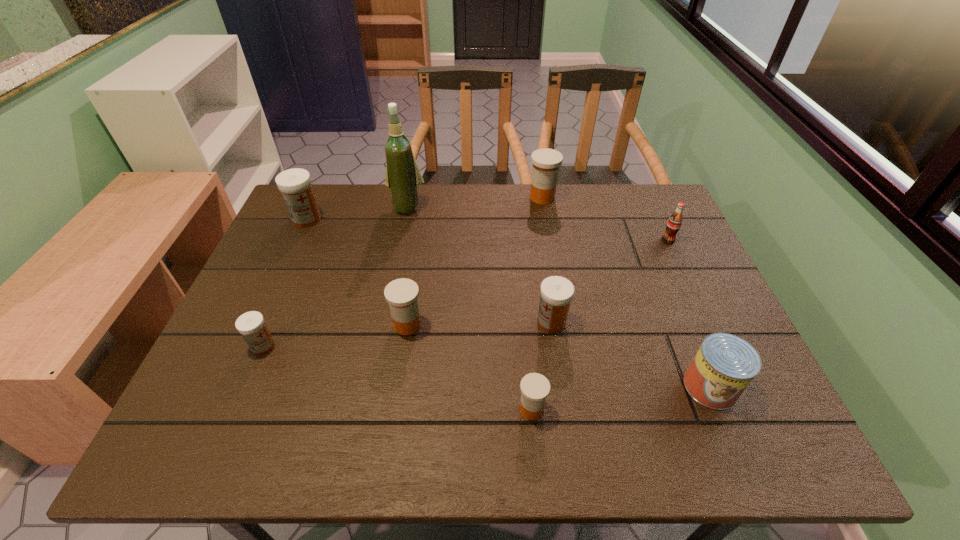
Find the location of a particular element. The image size is (960, 540). free location located 0.100m on the left of the can is located at coordinates (637, 387).

Locate an element on the screen. vacant space situated 0.240m on the right of the smallest white medicine is located at coordinates (379, 346).

I want to click on wine bottle located at the far edge, so click(x=403, y=177).

Locate an element on the screen. The height and width of the screenshot is (540, 960). object present at the near edge is located at coordinates (534, 387).

At what (x,y) coordinates should I click in order to perform the action: click on soda at the right edge. Please return your answer as a coordinate pair (x, y). Looking at the image, I should click on (674, 223).

Where is `can positioned at the right edge`? The height and width of the screenshot is (540, 960). can positioned at the right edge is located at coordinates (725, 364).

This screenshot has height=540, width=960. What are the coordinates of `object located in the far left corner section of the desktop` in the screenshot? It's located at (294, 184).

Where is `free location at the far edge`? free location at the far edge is located at coordinates (428, 213).

Identify the location of vacant area at the near edge. (405, 458).

The width and height of the screenshot is (960, 540). I want to click on vacant space at the left edge of the desktop, so click(x=290, y=315).